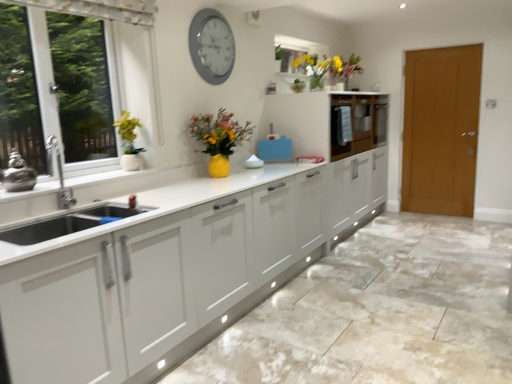
Question: Is brown wooden door at right surrounding matte white cabinet at center, arranged as the second cabinetry when viewed from the front?

Choices:
 (A) yes
 (B) no

Answer: (B)

Question: Is brown wooden door at right to the right of matte white cabinet at center, the 1th cabinetry positioned from the back, from the viewer's perspective?

Choices:
 (A) no
 (B) yes

Answer: (B)

Question: Is brown wooden door at right located outside matte white cabinet at center, arranged as the second cabinetry when viewed from the front?

Choices:
 (A) yes
 (B) no

Answer: (A)

Question: From the image's perspective, is brown wooden door at right below matte white cabinet at center, arranged as the second cabinetry when viewed from the front?

Choices:
 (A) no
 (B) yes

Answer: (B)

Question: Considering the relative sizes of brown wooden door at right and matte white cabinet at center, arranged as the second cabinetry when viewed from the front, in the image provided, is brown wooden door at right thinner than matte white cabinet at center, arranged as the second cabinetry when viewed from the front,?

Choices:
 (A) yes
 (B) no

Answer: (A)

Question: From a real-world perspective, is brown wooden door at right over matte white cabinet at center, the 1th cabinetry positioned from the back?

Choices:
 (A) no
 (B) yes

Answer: (A)

Question: Is matte white cabinet at center, which is the 2th cabinetry in back-to-front order, completely or partially inside white marble granite at lower center?

Choices:
 (A) yes
 (B) no

Answer: (B)

Question: From a real-world perspective, is white marble granite at lower center on matte white cabinet at center, which is the 2th cabinetry in back-to-front order?

Choices:
 (A) no
 (B) yes

Answer: (A)

Question: From a real-world perspective, is white marble granite at lower center located beneath matte white cabinet at center, marked as the first cabinetry in a front-to-back arrangement?

Choices:
 (A) no
 (B) yes

Answer: (B)

Question: Is white marble granite at lower center at the right side of matte white cabinet at center, which is the 2th cabinetry in back-to-front order?

Choices:
 (A) no
 (B) yes

Answer: (B)

Question: Is white marble granite at lower center at the left side of matte white cabinet at center, which is the 2th cabinetry in back-to-front order?

Choices:
 (A) no
 (B) yes

Answer: (A)

Question: Is white marble granite at lower center oriented towards matte white cabinet at center, which is the 2th cabinetry in back-to-front order?

Choices:
 (A) no
 (B) yes

Answer: (A)

Question: Does matte white cabinet at center, arranged as the second cabinetry when viewed from the front, have a lesser height compared to white marble granite at lower center?

Choices:
 (A) yes
 (B) no

Answer: (B)